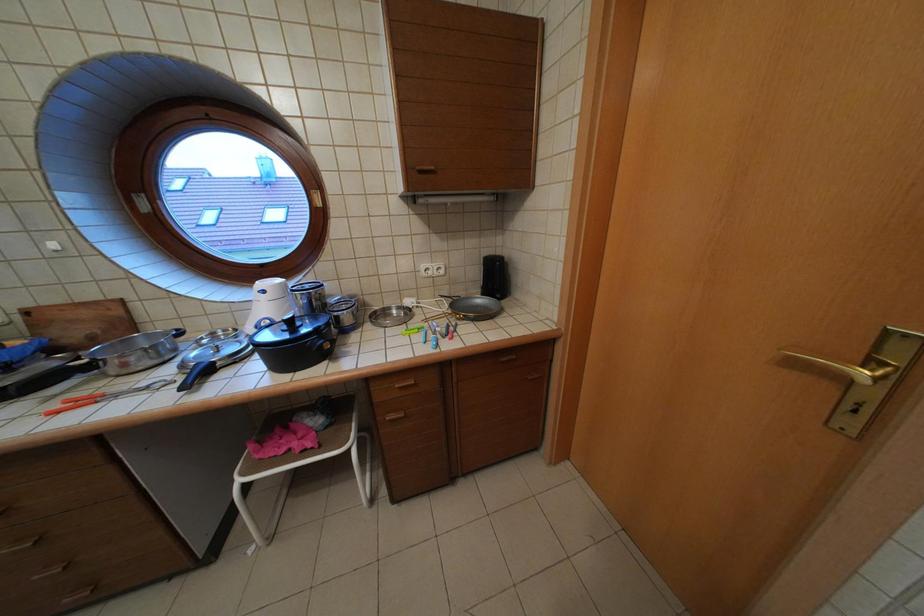
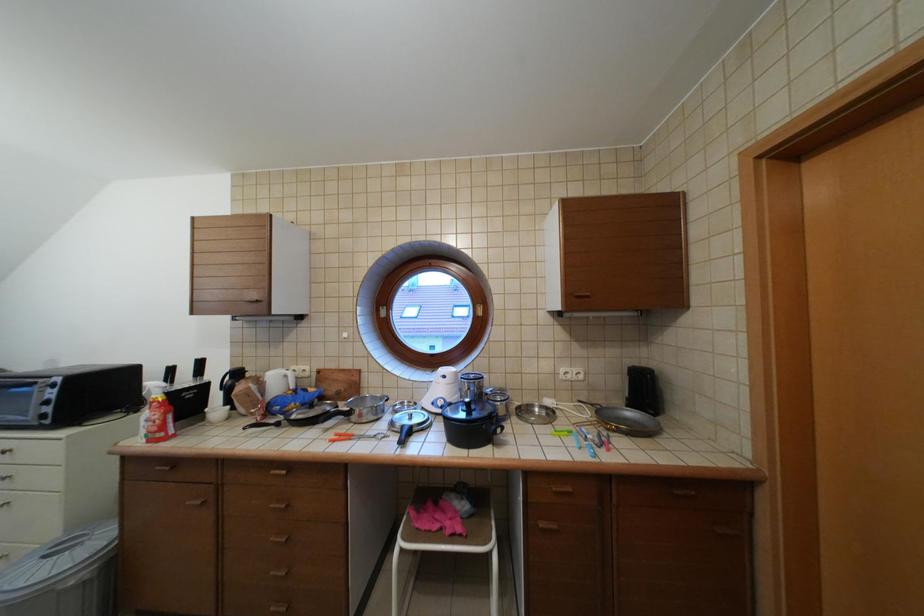
The images are taken continuously from a first-person perspective. In which direction is your viewpoint rotating?

The camera rotated toward left-up.